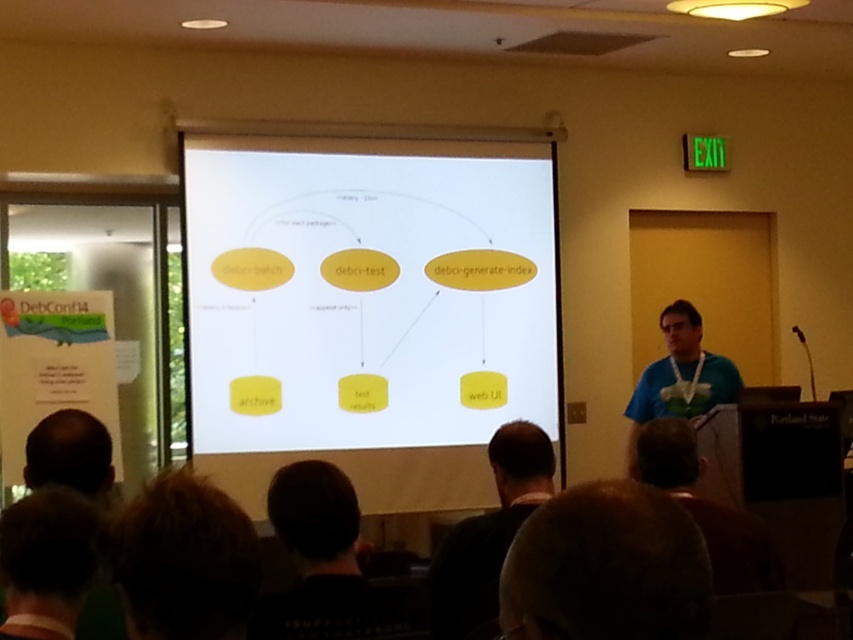
Does brown hair at lower center appear on the left side of blue t-shirt at right?

Indeed, brown hair at lower center is positioned on the left side of blue t-shirt at right.

Is point (566, 572) positioned before point (670, 369)?

Yes.

Identify the location of brown hair at lower center. (606, 566).

Does dark brown hair at lower center appear on the left side of blue t-shirt at right?

Yes, dark brown hair at lower center is to the left of blue t-shirt at right.

Which of these two, dark brown hair at lower center or blue t-shirt at right, stands shorter?

dark brown hair at lower center is shorter.

The image size is (853, 640). Identify the location of dark brown hair at lower center. (488, 536).

Find the location of `yellow matte diagram at center`. yellow matte diagram at center is located at coordinates (367, 308).

In the scene shown: Can you confirm if yellow matte diagram at center is shorter than dark brown hair at lower center?

Incorrect, yellow matte diagram at center's height does not fall short of dark brown hair at lower center's.

Does point (415, 289) come behind point (461, 608)?

That is True.

Where is `yellow matte diagram at center`? The image size is (853, 640). yellow matte diagram at center is located at coordinates (367, 308).